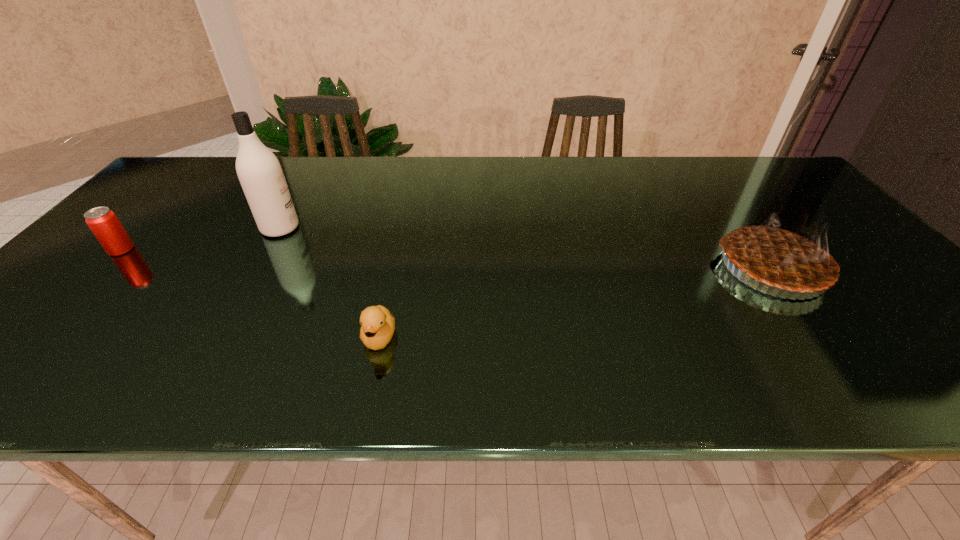
This screenshot has height=540, width=960. I want to click on free space between the shampoo and the leftmost object, so click(x=201, y=239).

Locate an element on the screen. The width and height of the screenshot is (960, 540). free space between the second object from right to left and the rightmost object is located at coordinates (576, 302).

This screenshot has height=540, width=960. I want to click on free space between the shampoo and the rightmost object, so click(526, 248).

This screenshot has width=960, height=540. I want to click on unoccupied position between the shampoo and the leftmost object, so click(201, 239).

Find the location of a particular element. This screenshot has height=540, width=960. free space between the third tallest object and the third shortest object is located at coordinates (447, 259).

At what (x,y) coordinates should I click in order to perform the action: click on free space between the rightmost object and the shampoo. Please return your answer as a coordinate pair (x, y). This screenshot has width=960, height=540. Looking at the image, I should click on (526, 248).

The image size is (960, 540). What are the coordinates of `vacant area that lies between the rightmost object and the duckling` in the screenshot? It's located at (576, 302).

Find the location of a particular element. unoccupied position between the rightmost object and the can is located at coordinates (447, 259).

Where is `free area in between the second tallest object and the duckling`? free area in between the second tallest object and the duckling is located at coordinates (576, 302).

Find the location of a particular element. The image size is (960, 540). free area in between the leftmost object and the duckling is located at coordinates (251, 293).